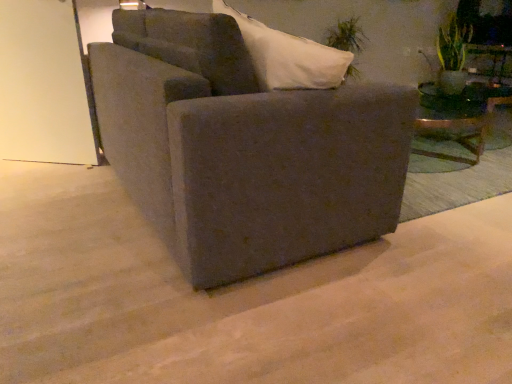
The image size is (512, 384). What do you see at coordinates (243, 148) in the screenshot?
I see `matte gray couch at center` at bounding box center [243, 148].

What do you see at coordinates (452, 55) in the screenshot? The height and width of the screenshot is (384, 512). I see `green leafy plant at upper right, which is counted as the second plant, starting from the left` at bounding box center [452, 55].

Find the location of a particular element. transparent glass door at upper left is located at coordinates (44, 85).

Looking at this image, is matte gray couch at center positioned far away from green leafy plant at upper right, which is counted as the second plant, starting from the left?

Yes, matte gray couch at center is far from green leafy plant at upper right, which is counted as the second plant, starting from the left.

Is green leafy plant at upper right, placed as the 2th plant when sorted from back to front, inside matte gray couch at center?

No, matte gray couch at center does not contain green leafy plant at upper right, placed as the 2th plant when sorted from back to front.

In the scene shown: Is the depth of matte gray couch at center less than that of green leafy plant at upper right, placed as the 2th plant when sorted from back to front?

Yes, matte gray couch at center is in front of green leafy plant at upper right, placed as the 2th plant when sorted from back to front.

Is matte gray couch at center positioned with its back to green leafy plant at upper right, acting as the 1th plant starting from the right?

That's not correct — matte gray couch at center is not looking away from green leafy plant at upper right, acting as the 1th plant starting from the right.

Locate an element on the screen. The height and width of the screenshot is (384, 512). glass door in front of the green leafy plant at upper right, which is counted as the second plant, starting from the left is located at coordinates (44, 85).

From a real-world perspective, who is located lower, green leafy plant at upper right, which is counted as the second plant, starting from the left, or transparent glass door at upper left?

transparent glass door at upper left is physically lower.

From the image's perspective, is green leafy plant at upper right, which is counted as the second plant, starting from the left, located above transparent glass door at upper left?

Yes, from the image's perspective, green leafy plant at upper right, which is counted as the second plant, starting from the left, is above transparent glass door at upper left.

Are green leafy plant at upper right, the 1th plant viewed from the front, and transparent glass door at upper left beside each other?

green leafy plant at upper right, the 1th plant viewed from the front, and transparent glass door at upper left are not in contact.

Considering the positions of objects green leafy plant at upper right, positioned as the first plant in back-to-front order, and transparent glass door at upper left in the image provided, who is in front, green leafy plant at upper right, positioned as the first plant in back-to-front order, or transparent glass door at upper left?

Positioned in front is transparent glass door at upper left.

From a real-world perspective, between green leafy plant at upper right, positioned as the first plant in back-to-front order, and transparent glass door at upper left, who is vertically higher?

In real-world perspective, green leafy plant at upper right, positioned as the first plant in back-to-front order, is above.

Are green leafy plant at upper right, placed as the 2th plant when sorted from front to back, and transparent glass door at upper left making contact?

green leafy plant at upper right, placed as the 2th plant when sorted from front to back, and transparent glass door at upper left are clearly separated.

Which is in front, point (340, 32) or point (67, 50)?

The point (67, 50) is more forward.

Is green leafy plant at upper right, which ranks as the second plant in right-to-left order, inside green leafy plant at upper right, acting as the 1th plant starting from the right?

That's incorrect, green leafy plant at upper right, which ranks as the second plant in right-to-left order, is not inside green leafy plant at upper right, acting as the 1th plant starting from the right.

Which of these two, green leafy plant at upper right, acting as the 1th plant starting from the right, or green leafy plant at upper right, the 1th plant when ordered from left to right, is bigger?

Bigger between the two is green leafy plant at upper right, the 1th plant when ordered from left to right.

From their relative heights in the image, would you say green leafy plant at upper right, the 1th plant viewed from the front, is taller or shorter than green leafy plant at upper right, placed as the 2th plant when sorted from front to back?

Considering their sizes, green leafy plant at upper right, the 1th plant viewed from the front, has less height than green leafy plant at upper right, placed as the 2th plant when sorted from front to back.

From a real-world perspective, who is located higher, green leafy plant at upper right, placed as the 2th plant when sorted from back to front, or green leafy plant at upper right, positioned as the first plant in back-to-front order?

From a 3D spatial view, green leafy plant at upper right, placed as the 2th plant when sorted from back to front, is above.

How different are the orientations of green leafy plant at upper right, the 1th plant when ordered from left to right, and green leafy plant at upper right, acting as the 1th plant starting from the right, in degrees?

They differ by 0.000416 degrees in their facing directions.

This screenshot has width=512, height=384. What are the coordinates of `plant located above the green leafy plant at upper right, acting as the 1th plant starting from the right (from the image's perspective)` in the screenshot? It's located at (346, 36).

Is green leafy plant at upper right, the 1th plant when ordered from left to right, at the right side of green leafy plant at upper right, which is counted as the second plant, starting from the left?

No.

Can you tell me how much transparent glass door at upper left and green leafy plant at upper right, placed as the 2th plant when sorted from back to front, differ in facing direction?

There is a 38.2-degree angle between the facing directions of transparent glass door at upper left and green leafy plant at upper right, placed as the 2th plant when sorted from back to front.

From the picture: From a real-world perspective, is transparent glass door at upper left under green leafy plant at upper right, the 1th plant viewed from the front?

Yes, from a real-world perspective, transparent glass door at upper left is below green leafy plant at upper right, the 1th plant viewed from the front.

Who is bigger, transparent glass door at upper left or green leafy plant at upper right, acting as the 1th plant starting from the right?

transparent glass door at upper left.

The width and height of the screenshot is (512, 384). Identify the location of glass door that is below the green leafy plant at upper right, acting as the 1th plant starting from the right (from the image's perspective). (44, 85).

Between green leafy plant at upper right, the 1th plant viewed from the front, and matte gray couch at center, which one has larger width?

Wider between the two is matte gray couch at center.

Is green leafy plant at upper right, which is counted as the second plant, starting from the left, facing away from matte gray couch at center?

green leafy plant at upper right, which is counted as the second plant, starting from the left, is not turned away from matte gray couch at center.

Can you confirm if green leafy plant at upper right, placed as the 2th plant when sorted from back to front, is positioned to the right of matte gray couch at center?

Yes, green leafy plant at upper right, placed as the 2th plant when sorted from back to front, is to the right of matte gray couch at center.

In the image, there is a green leafy plant at upper right, placed as the 2th plant when sorted from back to front. Identify the location of chair below it (from a real-world perspective). The image size is (512, 384). (243, 148).

From the image's perspective, starting from the transparent glass door at upper left, which plant is the 1st one above? Please provide its 2D coordinates.

[(452, 55)]

Based on their spatial positions, is green leafy plant at upper right, which ranks as the second plant in right-to-left order, or transparent glass door at upper left further from matte gray couch at center?

green leafy plant at upper right, which ranks as the second plant in right-to-left order, lies further to matte gray couch at center than the other object.

From the image, which object appears to be farther from green leafy plant at upper right, the 1th plant viewed from the front, green leafy plant at upper right, the 1th plant when ordered from left to right, or transparent glass door at upper left?

The object further to green leafy plant at upper right, the 1th plant viewed from the front, is transparent glass door at upper left.

From the image, which object appears to be nearer to green leafy plant at upper right, acting as the 1th plant starting from the right, matte gray couch at center or transparent glass door at upper left?

Among the two, matte gray couch at center is located nearer to green leafy plant at upper right, acting as the 1th plant starting from the right.

Looking at this image, estimate the real-world distances between objects in this image. Which object is further from green leafy plant at upper right, the 1th plant when ordered from left to right, green leafy plant at upper right, acting as the 1th plant starting from the right, or transparent glass door at upper left?

transparent glass door at upper left is positioned further to the anchor green leafy plant at upper right, the 1th plant when ordered from left to right.

Looking at the image, which one is located further to green leafy plant at upper right, positioned as the first plant in back-to-front order, green leafy plant at upper right, which is counted as the second plant, starting from the left, or matte gray couch at center?

Based on the image, matte gray couch at center appears to be further to green leafy plant at upper right, positioned as the first plant in back-to-front order.

When comparing their distances from transparent glass door at upper left, does matte gray couch at center or green leafy plant at upper right, positioned as the first plant in back-to-front order, seem closer?

matte gray couch at center.

Consider the image. From the image, which object appears to be farther from transparent glass door at upper left, green leafy plant at upper right, positioned as the first plant in back-to-front order, or green leafy plant at upper right, acting as the 1th plant starting from the right?

green leafy plant at upper right, acting as the 1th plant starting from the right.

From the image, which object appears to be nearer to green leafy plant at upper right, positioned as the first plant in back-to-front order, matte gray couch at center or green leafy plant at upper right, the 1th plant viewed from the front?

Based on the image, green leafy plant at upper right, the 1th plant viewed from the front, appears to be nearer to green leafy plant at upper right, positioned as the first plant in back-to-front order.

The height and width of the screenshot is (384, 512). In order to click on chair between transparent glass door at upper left and green leafy plant at upper right, the 1th plant viewed from the front, from left to right in this screenshot , I will do `click(243, 148)`.

Identify the location of plant between matte gray couch at center and green leafy plant at upper right, which ranks as the second plant in right-to-left order, along the z-axis. (452, 55).

Where is `glass door positioned between matte gray couch at center and green leafy plant at upper right, positioned as the first plant in back-to-front order, from near to far`? The height and width of the screenshot is (384, 512). glass door positioned between matte gray couch at center and green leafy plant at upper right, positioned as the first plant in back-to-front order, from near to far is located at coordinates (44, 85).

Locate an element on the screen. plant between transparent glass door at upper left and green leafy plant at upper right, the 1th plant viewed from the front, from left to right is located at coordinates (346, 36).